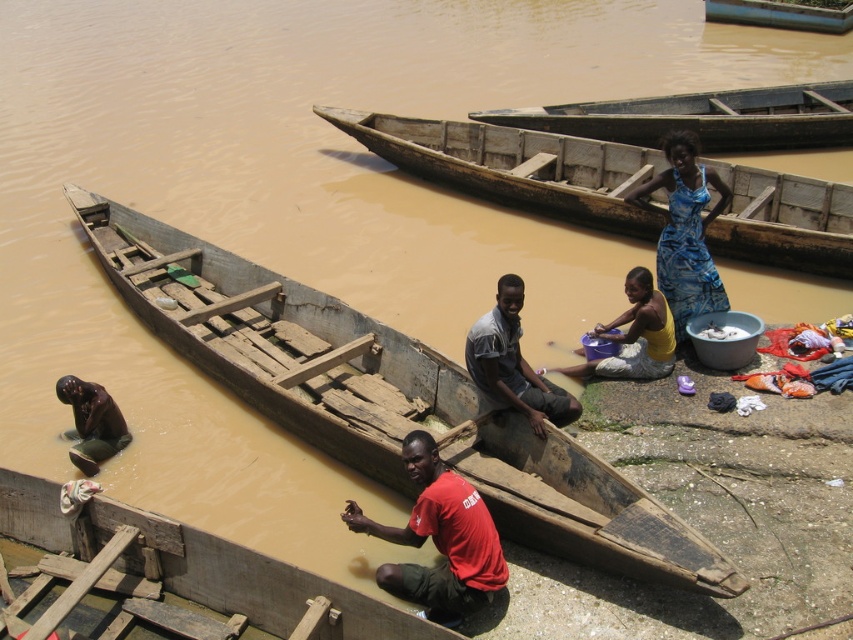
Question: Which object is the closest to the matte red shirt at lower center?

Choices:
 (A) yellow matte bucket at center
 (B) wooden canoe at center
 (C) wooden canoe at lower center
 (D) dark skin human at lower left

Answer: (C)

Question: Can you confirm if wooden boat at center is wider than gray fabric shirt at center?

Choices:
 (A) no
 (B) yes

Answer: (A)

Question: Which point appears closest to the camera in this image?

Choices:
 (A) (662, 358)
 (B) (509, 115)

Answer: (A)

Question: Can you confirm if wooden boat at center is smaller than dark skin human at lower left?

Choices:
 (A) no
 (B) yes

Answer: (B)

Question: Can you confirm if matte red shirt at lower center is wider than yellow matte bucket at center?

Choices:
 (A) no
 (B) yes

Answer: (A)

Question: Which of the following is the closest to the observer?

Choices:
 (A) gray fabric shirt at center
 (B) dark skin human at lower left
 (C) wooden canoe at lower center

Answer: (C)